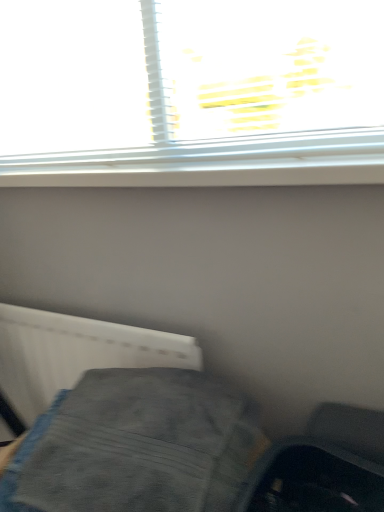
Question: Considering the positions of gray fabric at lower left and white plastic radiator at lower left in the image, is gray fabric at lower left wider or thinner than white plastic radiator at lower left?

Choices:
 (A) thin
 (B) wide

Answer: (B)

Question: From a real-world perspective, is gray fabric at lower left positioned above or below white plastic radiator at lower left?

Choices:
 (A) below
 (B) above

Answer: (B)

Question: Considering the positions of gray fabric at lower left and white plastic radiator at lower left in the image, is gray fabric at lower left taller or shorter than white plastic radiator at lower left?

Choices:
 (A) tall
 (B) short

Answer: (B)

Question: Looking at their shapes, would you say white plastic radiator at lower left is wider or thinner than gray fabric at lower left?

Choices:
 (A) thin
 (B) wide

Answer: (A)

Question: From a real-world perspective, relative to gray fabric at lower left, is white plastic radiator at lower left vertically above or below?

Choices:
 (A) below
 (B) above

Answer: (A)

Question: Does point tap(72, 328) appear closer or farther from the camera than point tap(238, 402)?

Choices:
 (A) farther
 (B) closer

Answer: (A)

Question: Considering the positions of white plastic radiator at lower left and gray fabric at lower left in the image, is white plastic radiator at lower left taller or shorter than gray fabric at lower left?

Choices:
 (A) tall
 (B) short

Answer: (A)